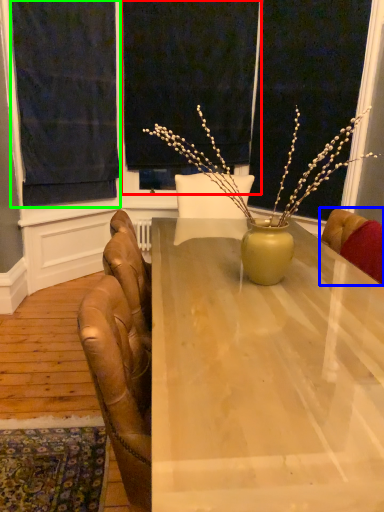
Question: Which object is the closest to the window screen (highlighted by a red box)? Choose among these: chair (highlighted by a blue box) or curtain (highlighted by a green box).

Choices:
 (A) chair
 (B) curtain

Answer: (B)